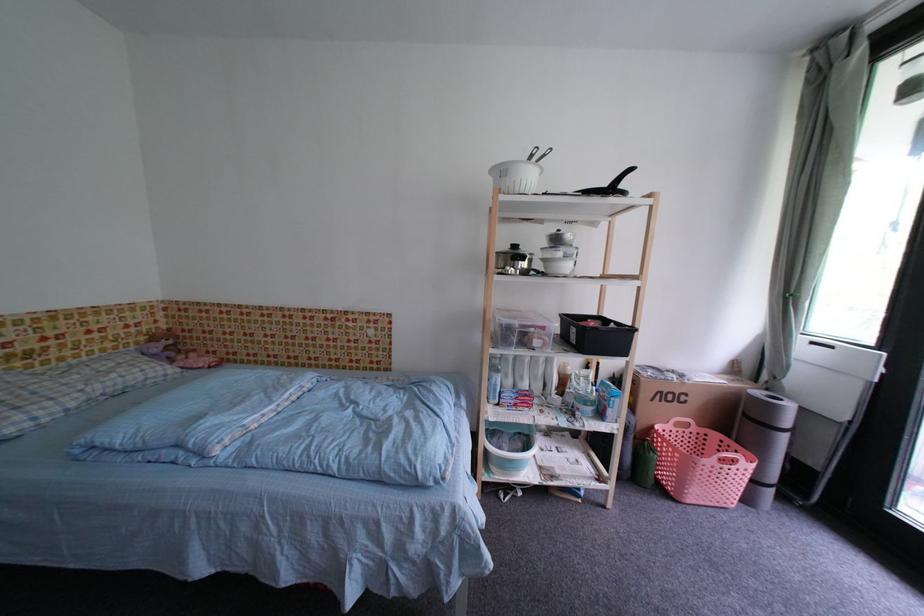
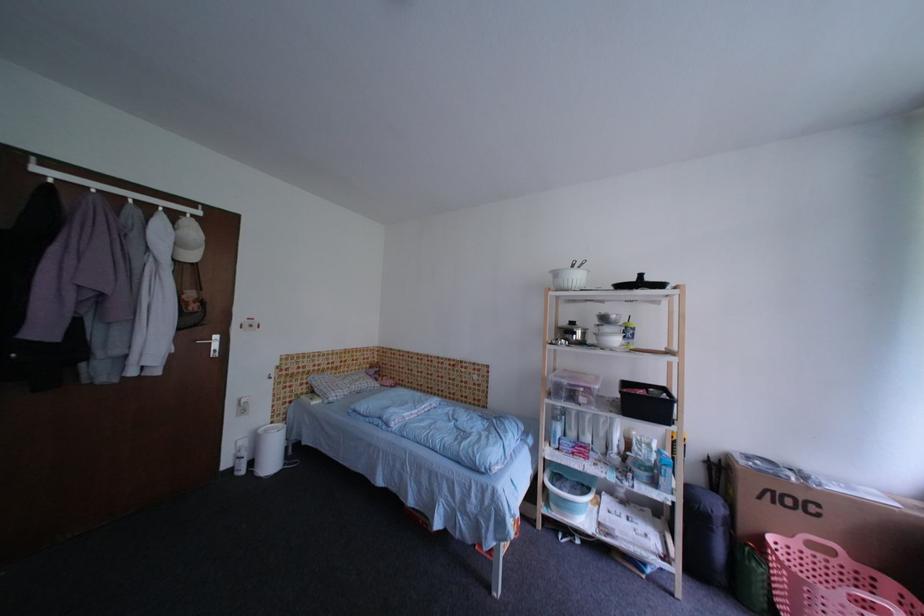
Question: The camera is either moving clockwise (left) or counter-clockwise (right) around the object. The first image is from the beginning of the video and the second image is from the end. Is the camera moving left or right when shooting the video?

Choices:
 (A) Left
 (B) Right

Answer: (B)